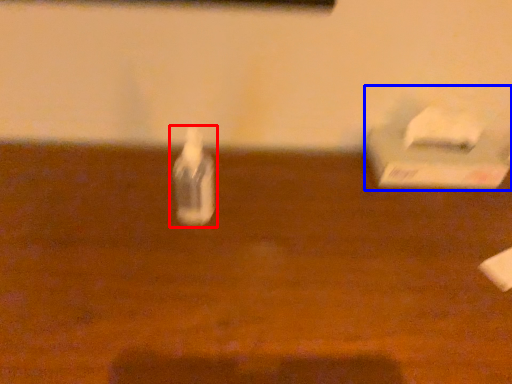
Question: Which object appears farthest to the camera in this image, bottle (highlighted by a red box) or box (highlighted by a blue box)?

Choices:
 (A) bottle
 (B) box

Answer: (B)